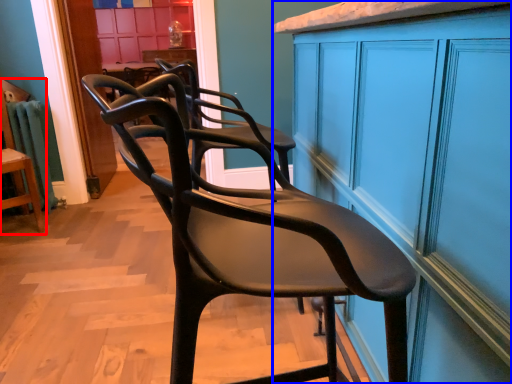
Question: Which point is further to the camera, chair (highlighted by a red box) or cabinetry (highlighted by a blue box)?

Choices:
 (A) chair
 (B) cabinetry

Answer: (A)